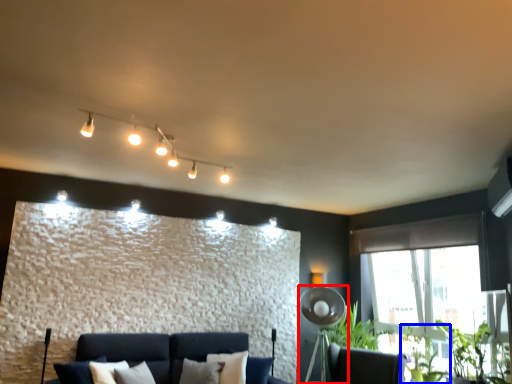
Question: Which point is further to the camera, fan (highlighted by a red box) or plant (highlighted by a blue box)?

Choices:
 (A) fan
 (B) plant

Answer: (A)